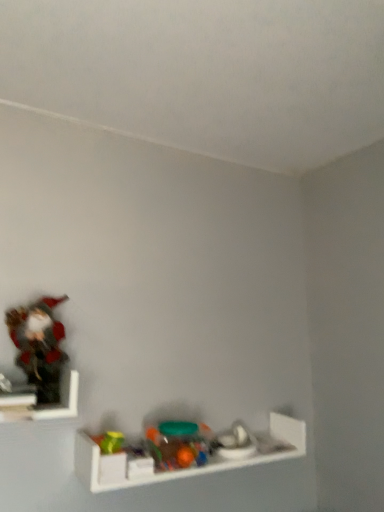
What is the approximate height of translucent plastic toy at lower center, which is counted as the 3th toy, starting from the top?

translucent plastic toy at lower center, which is counted as the 3th toy, starting from the top, is 3.27 inches in height.

From the picture: Measure the distance between translucent plastic toys at lower center, which ranks as the 2th shelf in left-to-right order, and camera.

They are 3.86 feet apart.

Where is `translucent plastic toy at lower center, the first toy positioned from the right`? The height and width of the screenshot is (512, 384). translucent plastic toy at lower center, the first toy positioned from the right is located at coordinates (234, 443).

Is translucent plastic toy at lower center, which is counted as the 3th toy, starting from the top, completely or partially outside of translucent plastic toys at center, the second toy from the left?

translucent plastic toy at lower center, which is counted as the 3th toy, starting from the top, lies outside translucent plastic toys at center, the second toy from the left,'s area.

Consider the image. From the image's perspective, which one is positioned higher, translucent plastic toy at lower center, marked as the 1th toy in a bottom-to-top arrangement, or translucent plastic toys at center, the second toy from the left?

translucent plastic toys at center, the second toy from the left, appears higher in the image.

In the image, there is a translucent plastic toys at center, acting as the 2th toy starting from the top. Where is `toy below it (from the image's perspective)`? This screenshot has height=512, width=384. toy below it (from the image's perspective) is located at coordinates (234, 443).

Which of these two, translucent plastic toy at lower center, the first toy positioned from the right, or translucent plastic toys at center, the second toy when ordered from right to left, stands taller?

translucent plastic toys at center, the second toy when ordered from right to left.

Is point (70, 370) positioned after point (149, 459)?

No, it is not.

Between wooden figurine at left, which ranks as the 2th shelf in bottom-to-top order, and translucent plastic toys at lower center, which ranks as the 2th shelf in left-to-right order, which one has larger width?

wooden figurine at left, which ranks as the 2th shelf in bottom-to-top order.

From the image's perspective, is wooden figurine at left, marked as the second shelf in a right-to-left arrangement, located above or below translucent plastic toys at lower center, which ranks as the 2th shelf in left-to-right order?

wooden figurine at left, marked as the second shelf in a right-to-left arrangement, is above translucent plastic toys at lower center, which ranks as the 2th shelf in left-to-right order.

Looking at this image, is wooden figurine at left, the 1th shelf when ordered from top to bottom, facing towards translucent plastic toys at lower center, the 1th shelf ordered from the bottom?

No, wooden figurine at left, the 1th shelf when ordered from top to bottom, does not turn towards translucent plastic toys at lower center, the 1th shelf ordered from the bottom.

From a real-world perspective, who is located lower, wooden figurine at left, marked as the second shelf in a right-to-left arrangement, or translucent plastic toys at center, which is counted as the second toy, starting from the bottom?

In real-world perspective, translucent plastic toys at center, which is counted as the second toy, starting from the bottom, is lower.

What are the coordinates of `the 2nd toy behind the wooden figurine at left, which ranks as the 2th shelf in bottom-to-top order, starting your count from the anchor` in the screenshot? It's located at (178, 444).

Is point (55, 410) less distant than point (159, 434)?

Yes.

Is wooden figurine at left, which ranks as the 2th shelf in bottom-to-top order, wider or thinner than translucent plastic toys at center, which is counted as the second toy, starting from the bottom?

wooden figurine at left, which ranks as the 2th shelf in bottom-to-top order, is wider than translucent plastic toys at center, which is counted as the second toy, starting from the bottom.

Can you see translucent plastic toys at lower center, the second shelf in the top-to-bottom sequence, touching wooden figurine at left, marked as the second shelf in a right-to-left arrangement?

No.

Is translucent plastic toys at lower center, the second shelf in the top-to-bottom sequence, further to the viewer compared to wooden figurine at left, the 1th shelf when ordered from top to bottom?

Yes, translucent plastic toys at lower center, the second shelf in the top-to-bottom sequence, is behind wooden figurine at left, the 1th shelf when ordered from top to bottom.

Considering the positions of point (84, 461) and point (46, 404), is point (84, 461) closer or farther from the camera than point (46, 404)?

Point (84, 461).

Which of these two, translucent plastic toys at lower center, the 1th shelf ordered from the bottom, or wooden figurine at left, which ranks as the 2th shelf in bottom-to-top order, stands shorter?

Standing shorter between the two is translucent plastic toys at lower center, the 1th shelf ordered from the bottom.

Is point (189, 435) closer to viewer compared to point (245, 428)?

Yes.

From a real-world perspective, is translucent plastic toys at center, the second toy when ordered from right to left, positioned over translucent plastic toy at lower center, marked as the 1th toy in a bottom-to-top arrangement, based on gravity?

Yes, from a real-world perspective, translucent plastic toys at center, the second toy when ordered from right to left, is above translucent plastic toy at lower center, marked as the 1th toy in a bottom-to-top arrangement.

Is translucent plastic toys at center, the second toy when ordered from right to left, next to translucent plastic toy at lower center, placed as the third toy when sorted from left to right, and touching it?

No.

Which object is further away from the camera, translucent plastic toys at center, the second toy from the left, or wooden figurine at left, which ranks as the 2th shelf in bottom-to-top order?

translucent plastic toys at center, the second toy from the left.

Does point (153, 453) lie in front of point (8, 396)?

That is False.

Consider the image. Which object is wider, translucent plastic toys at center, acting as the 2th toy starting from the top, or wooden figurine at left, the 1th shelf when ordered from top to bottom?

With larger width is wooden figurine at left, the 1th shelf when ordered from top to bottom.

Are translucent plastic toys at center, which is counted as the second toy, starting from the bottom, and wooden figurine at left, which ranks as the 2th shelf in bottom-to-top order, beside each other?

translucent plastic toys at center, which is counted as the second toy, starting from the bottom, and wooden figurine at left, which ranks as the 2th shelf in bottom-to-top order, are clearly separated.

Looking at this image, are matte plastic figurine at left, acting as the 1th toy starting from the left, and translucent plastic toys at lower center, arranged as the 1th shelf when viewed from the right, making contact?

matte plastic figurine at left, acting as the 1th toy starting from the left, and translucent plastic toys at lower center, arranged as the 1th shelf when viewed from the right, are not in contact.

Looking at their sizes, would you say matte plastic figurine at left, positioned as the 3th toy in bottom-to-top order, is wider or thinner than translucent plastic toys at lower center, arranged as the 1th shelf when viewed from the right?

Considering their sizes, matte plastic figurine at left, positioned as the 3th toy in bottom-to-top order, looks slimmer than translucent plastic toys at lower center, arranged as the 1th shelf when viewed from the right.

Consider the image. From a real-world perspective, is matte plastic figurine at left, positioned as the 3th toy in bottom-to-top order, above or below translucent plastic toys at lower center, which ranks as the 2th shelf in left-to-right order?

matte plastic figurine at left, positioned as the 3th toy in bottom-to-top order, is above translucent plastic toys at lower center, which ranks as the 2th shelf in left-to-right order.

Locate an element on the screen. The image size is (384, 512). the 1st toy counting from the left of the translucent plastic toy at lower center, the first toy positioned from the right is located at coordinates (178, 444).

You are a GUI agent. You are given a task and a screenshot of the screen. Output one action in this format:
    pyautogui.click(x=<x>, y=<y>)
    Task: Click on the shelf that is above the translucent plastic toys at lower center, arranged as the 1th shelf when viewed from the right (from the image's perspective)
    This screenshot has width=384, height=512.
    Given the screenshot: What is the action you would take?
    pyautogui.click(x=47, y=404)

When comparing their distances from wooden figurine at left, marked as the second shelf in a right-to-left arrangement, does translucent plastic toys at center, which is counted as the second toy, starting from the bottom, or translucent plastic toys at lower center, arranged as the 1th shelf when viewed from the right, seem closer?

Based on the image, translucent plastic toys at lower center, arranged as the 1th shelf when viewed from the right, appears to be nearer to wooden figurine at left, marked as the second shelf in a right-to-left arrangement.

Looking at this image, considering their positions, is translucent plastic toys at lower center, the 1th shelf ordered from the bottom, positioned closer to translucent plastic toys at center, which is counted as the second toy, starting from the bottom, than translucent plastic toy at lower center, placed as the third toy when sorted from left to right?

Among the two, translucent plastic toys at lower center, the 1th shelf ordered from the bottom, is located nearer to translucent plastic toys at center, which is counted as the second toy, starting from the bottom.

When comparing their distances from translucent plastic toys at lower center, the 1th shelf ordered from the bottom, does matte plastic figurine at left, acting as the 1th toy starting from the left, or wooden figurine at left, which is counted as the first shelf, starting from the left, seem further?

Based on the image, matte plastic figurine at left, acting as the 1th toy starting from the left, appears to be further to translucent plastic toys at lower center, the 1th shelf ordered from the bottom.

Considering their positions, is translucent plastic toys at center, which is counted as the second toy, starting from the bottom, positioned closer to translucent plastic toys at lower center, the second shelf in the top-to-bottom sequence, than matte plastic figurine at left, positioned as the 3th toy in bottom-to-top order?

translucent plastic toys at center, which is counted as the second toy, starting from the bottom, is closer to translucent plastic toys at lower center, the second shelf in the top-to-bottom sequence.

Looking at the image, which one is located closer to translucent plastic toy at lower center, the first toy positioned from the right, translucent plastic toys at lower center, the 1th shelf ordered from the bottom, or translucent plastic toys at center, acting as the 2th toy starting from the top?

translucent plastic toys at lower center, the 1th shelf ordered from the bottom.

Based on their spatial positions, is wooden figurine at left, marked as the second shelf in a right-to-left arrangement, or translucent plastic toys at lower center, the second shelf in the top-to-bottom sequence, closer to translucent plastic toys at center, acting as the 2th toy starting from the top?

Among the two, translucent plastic toys at lower center, the second shelf in the top-to-bottom sequence, is located nearer to translucent plastic toys at center, acting as the 2th toy starting from the top.

From the image, which object appears to be farther from matte plastic figurine at left, positioned as the 3th toy in bottom-to-top order, translucent plastic toys at lower center, the 1th shelf ordered from the bottom, or translucent plastic toy at lower center, placed as the third toy when sorted from left to right?

Among the two, translucent plastic toy at lower center, placed as the third toy when sorted from left to right, is located further to matte plastic figurine at left, positioned as the 3th toy in bottom-to-top order.

When comparing their distances from translucent plastic toy at lower center, the first toy positioned from the right, does translucent plastic toys at center, which is counted as the second toy, starting from the bottom, or translucent plastic toys at lower center, the second shelf in the top-to-bottom sequence, seem further?

The object further to translucent plastic toy at lower center, the first toy positioned from the right, is translucent plastic toys at center, which is counted as the second toy, starting from the bottom.

This screenshot has height=512, width=384. I want to click on toy between translucent plastic toys at lower center, the second shelf in the top-to-bottom sequence, and translucent plastic toy at lower center, placed as the third toy when sorted from left to right, from front to back, so click(178, 444).

In order to click on toy between wooden figurine at left, marked as the second shelf in a right-to-left arrangement, and translucent plastic toys at center, the second toy from the left, from left to right in this screenshot , I will do `click(39, 345)`.

Locate an element on the screen. This screenshot has width=384, height=512. shelf situated between matte plastic figurine at left, arranged as the 1th toy when viewed from the top, and translucent plastic toy at lower center, marked as the 1th toy in a bottom-to-top arrangement, from left to right is located at coordinates (190, 466).

Find the location of `toy between matte plastic figurine at left, positioned as the 3th toy in bottom-to-top order, and translucent plastic toys at lower center, arranged as the 1th shelf when viewed from the right`. toy between matte plastic figurine at left, positioned as the 3th toy in bottom-to-top order, and translucent plastic toys at lower center, arranged as the 1th shelf when viewed from the right is located at coordinates (178, 444).